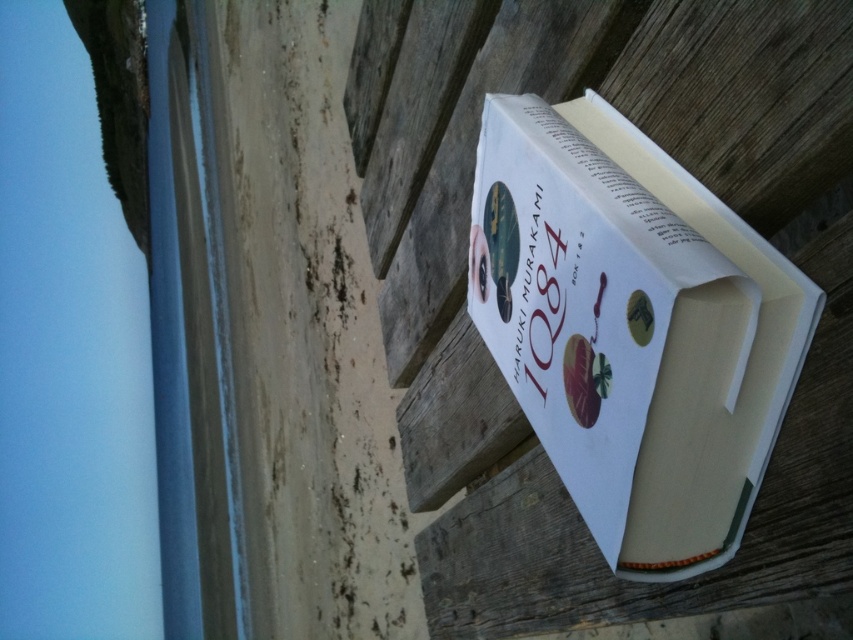
Who is higher up, white paper book at center or white paper at upper center?

Positioned higher is white paper at upper center.

Does white paper book at center appear on the left side of white paper at upper center?

Yes, white paper book at center is to the left of white paper at upper center.

This screenshot has width=853, height=640. In order to click on white paper book at center in this screenshot , I will do `click(631, 328)`.

Find the location of a particular element. The width and height of the screenshot is (853, 640). white paper book at center is located at coordinates (631, 328).

Does white paper book at center appear over white paper book at upper center?

No, white paper book at center is not above white paper book at upper center.

Who is taller, white paper book at center or white paper book at upper center?

white paper book at center

Where is `white paper book at center`? white paper book at center is located at coordinates (631, 328).

Is white paper book at upper center taller than white paper at upper center?

Yes.

Does white paper book at upper center appear on the left side of white paper at upper center?

Indeed, white paper book at upper center is positioned on the left side of white paper at upper center.

Find the location of a particular element. white paper book at upper center is located at coordinates (560, 305).